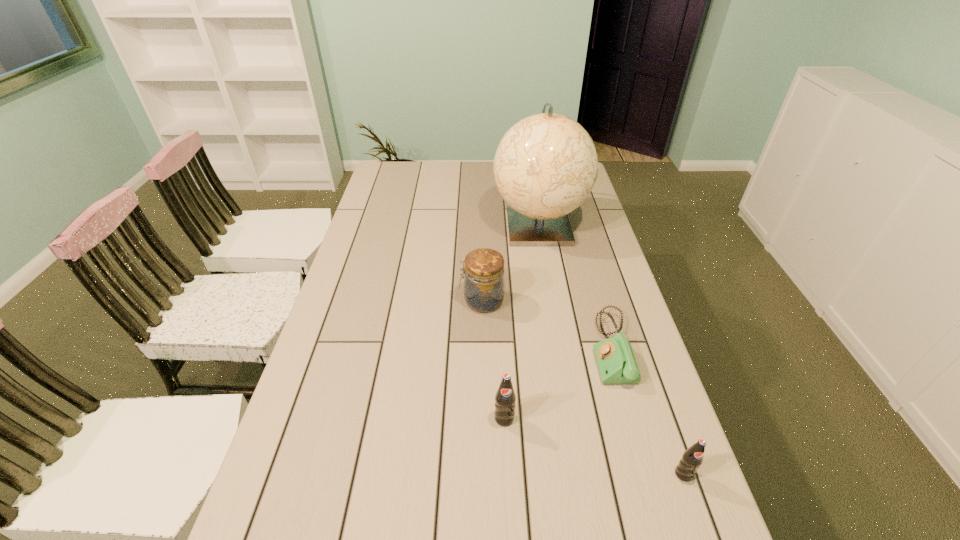
Identify the location of vacant space at the left edge of the desktop. (361, 220).

Find the location of `vacant region at the right edge of the desktop`. vacant region at the right edge of the desktop is located at coordinates (588, 263).

Where is `free space at the near left corner`? free space at the near left corner is located at coordinates (269, 524).

You are a GUI agent. You are given a task and a screenshot of the screen. Output one action in this format:
    pyautogui.click(x=<x>, y=<y>)
    Task: Click on the empty space that is in between the shorter pop and the telephone
    This screenshot has height=540, width=960.
    Given the screenshot: What is the action you would take?
    pyautogui.click(x=647, y=411)

Where is `unoccupied area between the farther pop and the shortest object`? The height and width of the screenshot is (540, 960). unoccupied area between the farther pop and the shortest object is located at coordinates (558, 383).

You are a GUI agent. You are given a task and a screenshot of the screen. Output one action in this format:
    pyautogui.click(x=<x>, y=<y>)
    Task: Click on the free space between the telephone and the left pop
    
    Given the screenshot: What is the action you would take?
    pyautogui.click(x=558, y=383)

Find the location of `free space between the jar and the globe`. free space between the jar and the globe is located at coordinates (510, 264).

I want to click on vacant space that is in between the tallest object and the farther pop, so click(521, 322).

The height and width of the screenshot is (540, 960). I want to click on free space that is in between the tallest object and the telephone, so click(x=575, y=287).

Where is `empty space between the farthest object and the jar`? empty space between the farthest object and the jar is located at coordinates (510, 264).